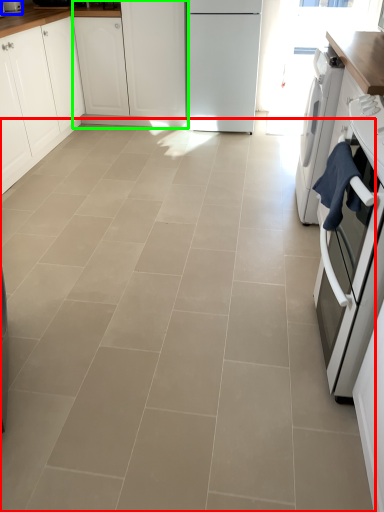
Question: Considering the real-world distances, which object is farthest from ceramic tile (highlighted by a red box)? kitchen appliance (highlighted by a blue box) or cabinetry (highlighted by a green box)?

Choices:
 (A) kitchen appliance
 (B) cabinetry

Answer: (A)